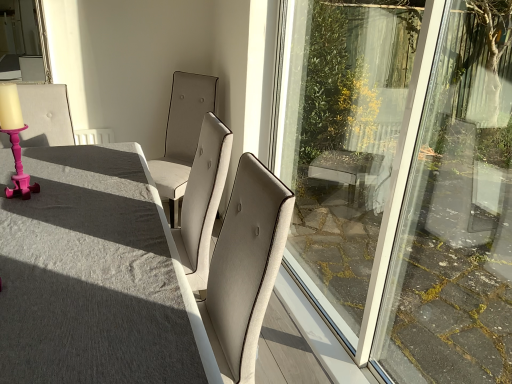
Where is `vacant space in front of pink wood candle holder at left`? The height and width of the screenshot is (384, 512). vacant space in front of pink wood candle holder at left is located at coordinates (18, 211).